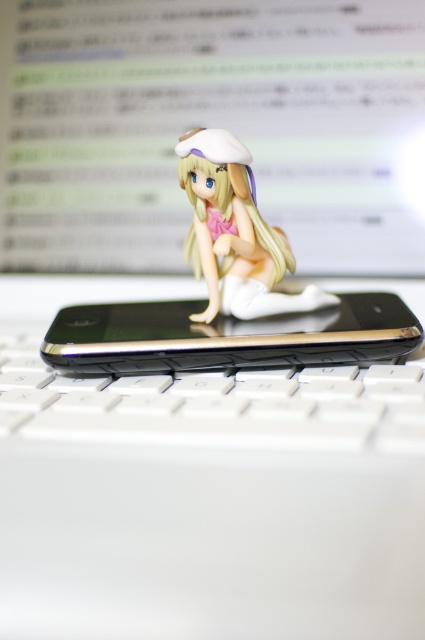
Question: Which point appears closest to the camera in this image?

Choices:
 (A) (190, 147)
 (B) (410, 429)
 (C) (102, 337)

Answer: (B)

Question: Is white plastic keyboard at center below satin white figurine at center?

Choices:
 (A) no
 (B) yes

Answer: (B)

Question: Does white plastic keyboard at center appear over satin white figurine at center?

Choices:
 (A) yes
 (B) no

Answer: (B)

Question: Which point is farther to the camera?

Choices:
 (A) black glossy smartphone at center
 (B) satin white figurine at center
 (C) white plastic keyboard at center

Answer: (B)

Question: Does white plastic keyboard at center appear over satin white figurine at center?

Choices:
 (A) no
 (B) yes

Answer: (A)

Question: Which object is closer to the camera taking this photo?

Choices:
 (A) white plastic keyboard at center
 (B) black glossy smartphone at center

Answer: (A)